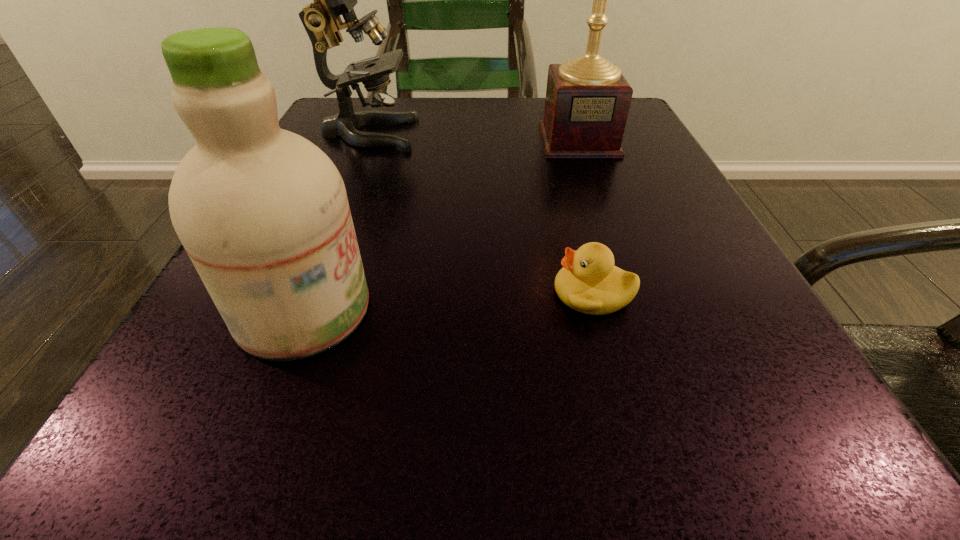
Identify the location of trophy cup situated at the far edge. (587, 102).

Identify the location of microscope that is at the far edge. (321, 19).

Locate an element on the screen. microscope located in the left edge section of the desktop is located at coordinates (321, 19).

The height and width of the screenshot is (540, 960). What are the coordinates of `cleansing agent that is at the left edge` in the screenshot? It's located at (262, 212).

The width and height of the screenshot is (960, 540). Find the location of `trophy cup at the right edge`. trophy cup at the right edge is located at coordinates (587, 102).

The image size is (960, 540). In order to click on duckling located at the right edge in this screenshot , I will do `click(589, 282)`.

Locate an element on the screen. This screenshot has width=960, height=540. object situated at the far left corner is located at coordinates (321, 19).

At what (x,y) coordinates should I click in order to perform the action: click on object present at the far right corner. Please return your answer as a coordinate pair (x, y). This screenshot has width=960, height=540. Looking at the image, I should click on (587, 102).

In the image, there is a desktop. At what (x,y) coordinates should I click in order to perform the action: click on vacant space at the far edge. Please return your answer as a coordinate pair (x, y). The image size is (960, 540). Looking at the image, I should click on (494, 114).

Locate an element on the screen. vacant space at the near edge of the desktop is located at coordinates (557, 479).